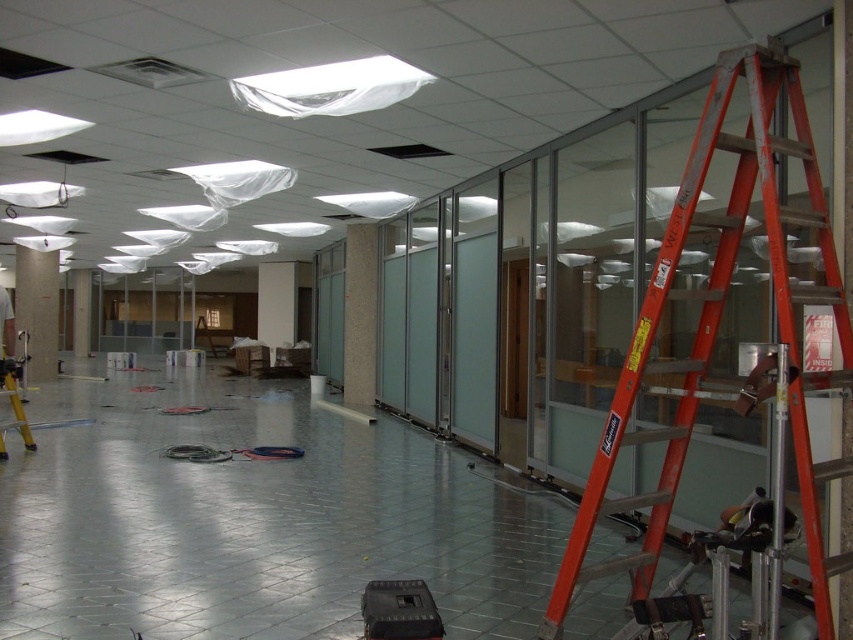
Question: Does orange metallic ladder at right appear over black plastic equipment at center?

Choices:
 (A) no
 (B) yes

Answer: (B)

Question: Estimate the real-world distances between objects in this image. Which object is closer to the black plastic equipment at center?

Choices:
 (A) matte gray pillar at left
 (B) orange metallic ladder at right

Answer: (B)

Question: Observing the image, what is the correct spatial positioning of clear glass partition at center in reference to matte gray pillar at left?

Choices:
 (A) left
 (B) right

Answer: (B)

Question: Which of these objects is positioned closest to the orange metallic ladder at right?

Choices:
 (A) black plastic equipment at center
 (B) clear glass partition at center
 (C) matte gray pillar at left

Answer: (A)

Question: Does orange metallic ladder at right appear on the left side of matte gray pillar at left?

Choices:
 (A) no
 (B) yes

Answer: (A)

Question: Which object appears farthest from the camera in this image?

Choices:
 (A) clear glass partition at center
 (B) black plastic equipment at center
 (C) matte gray pillar at left

Answer: (C)